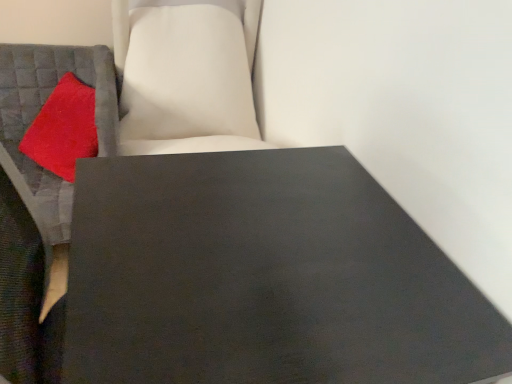
Question: Is matte gray cushion at left located outside velvety red pillow at left?

Choices:
 (A) yes
 (B) no

Answer: (A)

Question: From a real-world perspective, is matte gray cushion at left positioned under velvety red pillow at left based on gravity?

Choices:
 (A) no
 (B) yes

Answer: (B)

Question: Is velvety red pillow at left a part of matte gray cushion at left?

Choices:
 (A) no
 (B) yes

Answer: (B)

Question: Can you confirm if matte gray cushion at left is wider than velvety red pillow at left?

Choices:
 (A) no
 (B) yes

Answer: (B)

Question: From the image's perspective, is matte gray cushion at left under velvety red pillow at left?

Choices:
 (A) no
 (B) yes

Answer: (B)

Question: Can you confirm if matte gray cushion at left is bigger than velvety red pillow at left?

Choices:
 (A) yes
 (B) no

Answer: (A)

Question: Is matte black table at center in front of velvety red pillow at left?

Choices:
 (A) yes
 (B) no

Answer: (A)

Question: Is matte black table at center positioned behind velvety red pillow at left?

Choices:
 (A) no
 (B) yes

Answer: (A)

Question: Considering the relative sizes of matte black table at center and velvety red pillow at left in the image provided, is matte black table at center wider than velvety red pillow at left?

Choices:
 (A) yes
 (B) no

Answer: (A)

Question: From a real-world perspective, is matte black table at center on top of velvety red pillow at left?

Choices:
 (A) no
 (B) yes

Answer: (A)

Question: Can you confirm if matte black table at center is thinner than velvety red pillow at left?

Choices:
 (A) yes
 (B) no

Answer: (B)

Question: Considering the relative sizes of matte black table at center and velvety red pillow at left in the image provided, is matte black table at center taller than velvety red pillow at left?

Choices:
 (A) yes
 (B) no

Answer: (A)

Question: Can you confirm if velvety red pillow at left is smaller than matte black table at center?

Choices:
 (A) no
 (B) yes

Answer: (B)